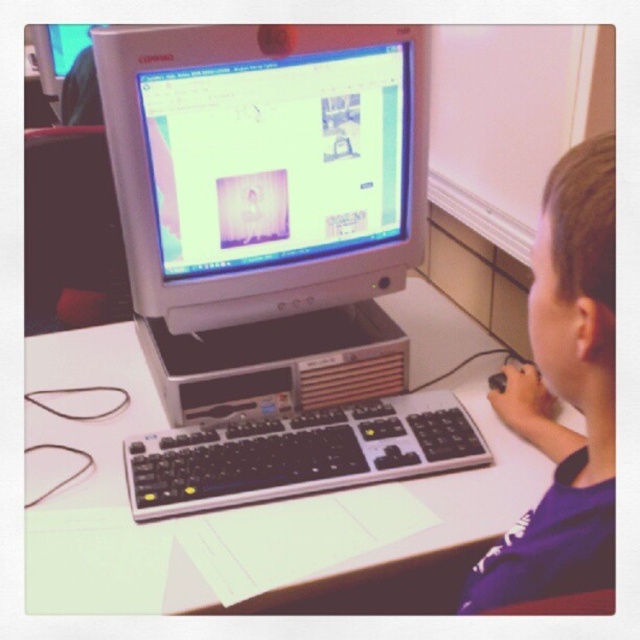
Question: Estimate the real-world distances between objects in this image. Which object is closer to the matte silver monitor at center?

Choices:
 (A) white plastic table at center
 (B) black plastic keyboard at center

Answer: (B)

Question: Does white plastic table at center appear on the left side of matte black monitor at upper left?

Choices:
 (A) no
 (B) yes

Answer: (A)

Question: Can you confirm if purple fabric shirt at right is positioned to the left of black plastic keyboard at center?

Choices:
 (A) no
 (B) yes

Answer: (A)

Question: Is black plastic keyboard at center to the right of matte black monitor at upper left from the viewer's perspective?

Choices:
 (A) yes
 (B) no

Answer: (A)

Question: Which object is closer to the camera taking this photo?

Choices:
 (A) black plastic keyboard at center
 (B) white plastic table at center

Answer: (B)

Question: Which point is closer to the camera taking this photo?

Choices:
 (A) (348, 32)
 (B) (534, 321)

Answer: (B)